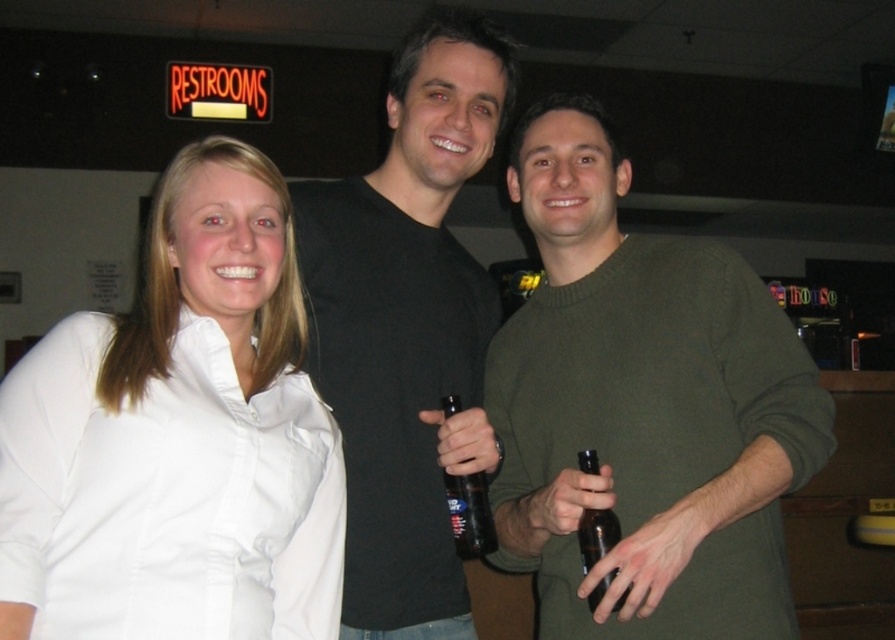
What do you see at coordinates (644, 408) in the screenshot? The height and width of the screenshot is (640, 895). I see `green matte sweater at center` at bounding box center [644, 408].

Between green matte sweater at center and black matte shirt at center, which one appears on the right side from the viewer's perspective?

Positioned to the right is green matte sweater at center.

Does point (491, 358) lie behind point (492, 317)?

That is False.

Where is `green matte sweater at center`? green matte sweater at center is located at coordinates tap(644, 408).

Is point (210, 448) more distant than point (594, 461)?

No, it is not.

Is point (267, 573) more distant than point (601, 518)?

That is False.

I want to click on white smooth shirt at left, so click(x=179, y=436).

Is the position of black glass bottle at center less distant than that of brown glass bottle at center?

That is False.

I want to click on black glass bottle at center, so click(x=470, y=515).